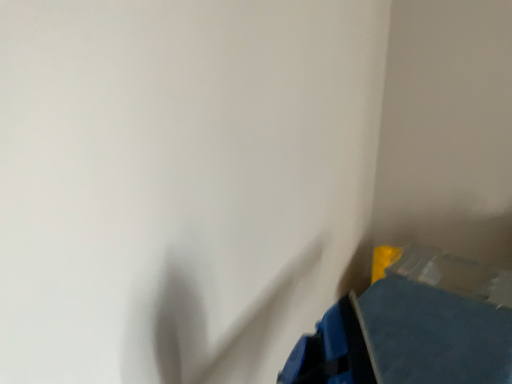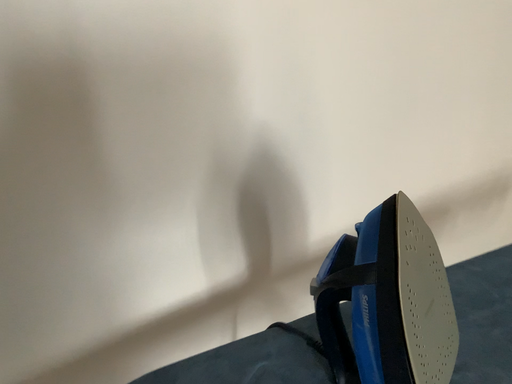
Question: How did the camera likely rotate when shooting the video?

Choices:
 (A) rotated left
 (B) rotated right

Answer: (A)